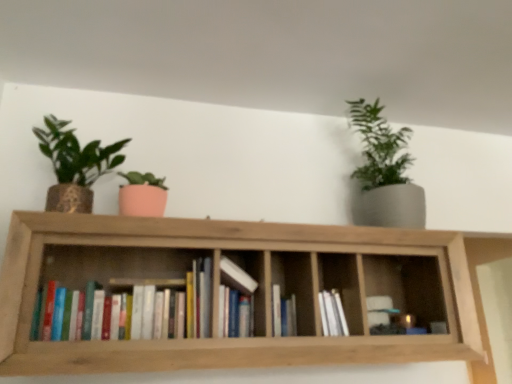
What is the approximate width of white matte books at center?

The width of white matte books at center is 8.50 inches.

The height and width of the screenshot is (384, 512). Describe the element at coordinates (346, 286) in the screenshot. I see `white matte books at center` at that location.

In order to face wooden bookshelf at center, should I rotate leftwards or rightwards?

You should look left and rotate roughly 0.116 degrees.

Find the location of `matte gray pot at upper right, the first houseplant from the right`. matte gray pot at upper right, the first houseplant from the right is located at coordinates [x=385, y=170].

Locate an element on the screen. This screenshot has height=384, width=512. white matte books at center is located at coordinates (346, 286).

Considering the relative sizes of hardcover book at center, which is the first book from right to left, and matte gold pot at left, which is the 1th houseplant from left to right, in the image provided, is hardcover book at center, which is the first book from right to left, taller than matte gold pot at left, which is the 1th houseplant from left to right,?

Incorrect, the height of hardcover book at center, which is the first book from right to left, is not larger of that of matte gold pot at left, which is the 1th houseplant from left to right.

Considering the relative positions of hardcover book at center, which is the first book from right to left, and matte gold pot at left, which appears as the second houseplant when viewed from the right, in the image provided, is hardcover book at center, which is the first book from right to left, in front of matte gold pot at left, which appears as the second houseplant when viewed from the right,?

That is False.

Does hardcover book at center, which is the first book from right to left, have a lesser width compared to matte gold pot at left, which is the 1th houseplant from left to right?

Indeed, hardcover book at center, which is the first book from right to left, has a lesser width compared to matte gold pot at left, which is the 1th houseplant from left to right.

Which is closer, (284, 301) or (49, 121)?

Point (284, 301) is positioned farther from the camera compared to point (49, 121).

Is matte gray pot at upper right, arranged as the 2th houseplant when viewed from the left, located outside wooden bookshelf at center?

That's correct, matte gray pot at upper right, arranged as the 2th houseplant when viewed from the left, is outside of wooden bookshelf at center.

Is the depth of matte gray pot at upper right, arranged as the 2th houseplant when viewed from the left, less than that of wooden bookshelf at center?

No, matte gray pot at upper right, arranged as the 2th houseplant when viewed from the left, is further to the viewer.

From a real-world perspective, is matte gray pot at upper right, arranged as the 2th houseplant when viewed from the left, positioned under wooden bookshelf at center based on gravity?

No.

Is white matte books at center completely or partially outside of hardcover book at center, the 2th book positioned from the left?

Yes.

I want to click on book that is the 2nd one when counting leftward from the white matte books at center, so click(x=240, y=299).

From a real-world perspective, which is physically below, white matte books at center or hardcover book at center, the 2th book positioned from the left?

white matte books at center, from a real-world perspective.

In the scene shown: From the image's perspective, between white matte books at center and hardcover book at center, which is the 2th book in right-to-left order, who is located below?

white matte books at center appears lower in the image.

Who is shorter, hardcover book at center, which is the 2th book in right-to-left order, or hardcover book at center, which is the first book from right to left?

Standing shorter between the two is hardcover book at center, which is the first book from right to left.

Locate an element on the screen. Image resolution: width=512 pixels, height=384 pixels. the 1st book counting from the left side of the hardcover book at center, the third book viewed from the left is located at coordinates (240, 299).

From a real-world perspective, does hardcover book at center, the 2th book positioned from the left, stand above hardcover book at center, the third book viewed from the left?

Yes, from a real-world perspective, hardcover book at center, the 2th book positioned from the left, is over hardcover book at center, the third book viewed from the left

Which object is positioned more to the right, hardcover book at center, the 2th book positioned from the left, or hardcover book at center, which is the first book from right to left?

hardcover book at center, which is the first book from right to left.

Is the position of white matte books at center less distant than that of hardcover book at center, which is the first book from right to left?

Yes, it is in front of hardcover book at center, which is the first book from right to left.

Is white matte books at center touching hardcover book at center, which is the first book from right to left?

No, white matte books at center is not beside hardcover book at center, which is the first book from right to left.

Find the location of a particular element. Image resolution: width=512 pixels, height=384 pixels. the 2nd book behind when counting from the white matte books at center is located at coordinates (283, 313).

Which object is positioned more to the right, white matte books at center or hardcover book at center, the third book viewed from the left?

white matte books at center is more to the right.

From the matte gray pot at upper right, the first houseplant from the right, count 2nd books forward and point to it. Please provide its 2D coordinates.

[(240, 299)]

In the scene shown: Considering the positions of objects matte gray pot at upper right, arranged as the 2th houseplant when viewed from the left, and hardcover book at center, the 2th book positioned from the left, in the image provided, who is behind, matte gray pot at upper right, arranged as the 2th houseplant when viewed from the left, or hardcover book at center, the 2th book positioned from the left,?

matte gray pot at upper right, arranged as the 2th houseplant when viewed from the left, is further away from the camera.

Does matte gray pot at upper right, the first houseplant from the right, have a larger size compared to hardcover book at center, the 2th book positioned from the left?

Indeed, matte gray pot at upper right, the first houseplant from the right, has a larger size compared to hardcover book at center, the 2th book positioned from the left.

Does point (417, 224) lie behind point (227, 275)?

Yes, it is.

Considering the relative sizes of hardcover book at center, which is the first book from right to left, and hardcover book at center, which is the 2th book in right-to-left order, in the image provided, is hardcover book at center, which is the first book from right to left, bigger than hardcover book at center, which is the 2th book in right-to-left order,?

No, hardcover book at center, which is the first book from right to left, is not bigger than hardcover book at center, which is the 2th book in right-to-left order.

Is hardcover book at center, the third book viewed from the left, outside of hardcover book at center, which is the 2th book in right-to-left order?

Indeed, hardcover book at center, the third book viewed from the left, is completely outside hardcover book at center, which is the 2th book in right-to-left order.

From a real-world perspective, is hardcover book at center, the third book viewed from the left, positioned above or below hardcover book at center, the 2th book positioned from the left?

hardcover book at center, the third book viewed from the left, is below hardcover book at center, the 2th book positioned from the left.

Identify the location of the 3rd book directly beneath the matte gold pot at left, which appears as the second houseplant when viewed from the right (from a real-world perspective). (283, 313).

What are the coordinates of `shelf on the left of matte gray pot at upper right, the first houseplant from the right` in the screenshot? It's located at (255, 293).

Based on their spatial positions, is hardcover books at center, the 3th book when ordered from right to left, or hardcover book at center, the 2th book positioned from the left, further from matte gold pot at left, which is the 1th houseplant from left to right?

hardcover book at center, the 2th book positioned from the left, is positioned further to the anchor matte gold pot at left, which is the 1th houseplant from left to right.

Considering their positions, is hardcover book at center, the 2th book positioned from the left, positioned further to hardcover book at center, the third book viewed from the left, than matte gray pot at upper right, arranged as the 2th houseplant when viewed from the left?

matte gray pot at upper right, arranged as the 2th houseplant when viewed from the left.

Considering their positions, is matte gray pot at upper right, the first houseplant from the right, positioned closer to matte gold pot at left, which is the 1th houseplant from left to right, than wooden bookshelf at center?

wooden bookshelf at center lies closer to matte gold pot at left, which is the 1th houseplant from left to right, than the other object.

From the image, which object appears to be farther from hardcover books at center, which appears as the 1th book when viewed from the left, hardcover book at center, the 2th book positioned from the left, or hardcover book at center, the third book viewed from the left?

Based on the image, hardcover book at center, the third book viewed from the left, appears to be further to hardcover books at center, which appears as the 1th book when viewed from the left.

From the image, which object appears to be farther from white matte books at center, hardcover book at center, which is the first book from right to left, or matte gold pot at left, which is the 1th houseplant from left to right?

matte gold pot at left, which is the 1th houseplant from left to right, is positioned further to the anchor white matte books at center.

Based on their spatial positions, is matte gold pot at left, which appears as the second houseplant when viewed from the right, or white matte books at center closer to wooden bookshelf at center?

Among the two, white matte books at center is located nearer to wooden bookshelf at center.

Based on their spatial positions, is matte gold pot at left, which is the 1th houseplant from left to right, or hardcover book at center, which is the first book from right to left, closer to wooden bookshelf at center?

Among the two, hardcover book at center, which is the first book from right to left, is located nearer to wooden bookshelf at center.

Based on their spatial positions, is hardcover book at center, which is the first book from right to left, or white matte books at center closer to hardcover books at center, the 3th book when ordered from right to left?

Among the two, hardcover book at center, which is the first book from right to left, is located nearer to hardcover books at center, the 3th book when ordered from right to left.

Identify the location of shelf situated between matte gold pot at left, which is the 1th houseplant from left to right, and matte gray pot at upper right, arranged as the 2th houseplant when viewed from the left, from left to right. The width and height of the screenshot is (512, 384). (255, 293).

The width and height of the screenshot is (512, 384). In order to click on cabinet between wooden bookshelf at center and hardcover book at center, which is the first book from right to left, in the front-back direction in this screenshot , I will do `click(346, 286)`.

Find the location of a particular element. The width and height of the screenshot is (512, 384). book between hardcover books at center, the 3th book when ordered from right to left, and wooden bookshelf at center from left to right is located at coordinates (240, 299).

Identify the location of shelf between matte gold pot at left, which is the 1th houseplant from left to right, and hardcover book at center, which is the first book from right to left. (255, 293).